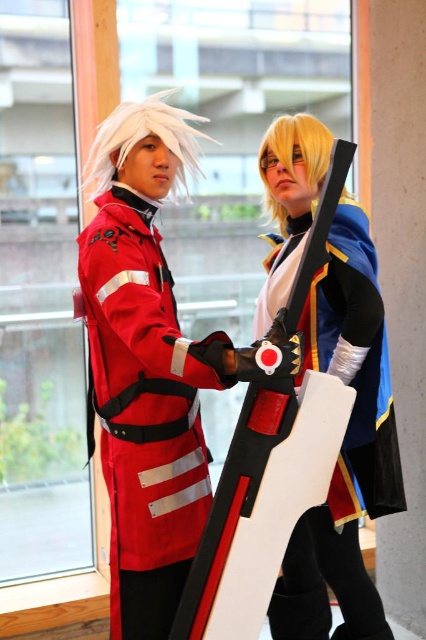
You are standing in a room with two cosplayers. You need to locate the matte red fabric uniform at left. Where exactly is it positioned in the room?

The matte red fabric uniform at left is located at point (143, 397) in the room.

You are a photographer trying to capture a photo of the shiny gold armor at center and the matte red fabric uniform at left. Which object should you focus on first if you want to include both in your shot without moving the camera?

The matte red fabric uniform at left is positioned on the left side of shiny gold armor at center, so you should focus on the shiny gold armor at center first to ensure both are in frame.